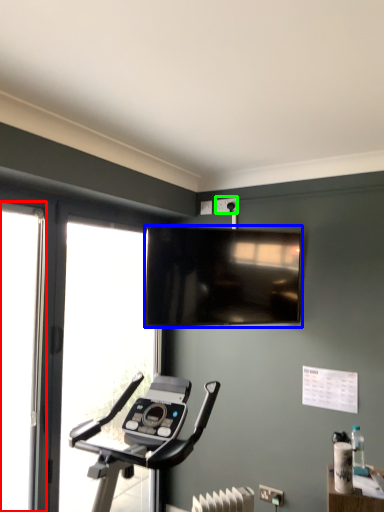
Question: Based on their relative distances, which object is nearer to screen door (highlighted by a red box)? Choose from television (highlighted by a blue box) and electric outlet (highlighted by a green box).

Choices:
 (A) television
 (B) electric outlet

Answer: (A)